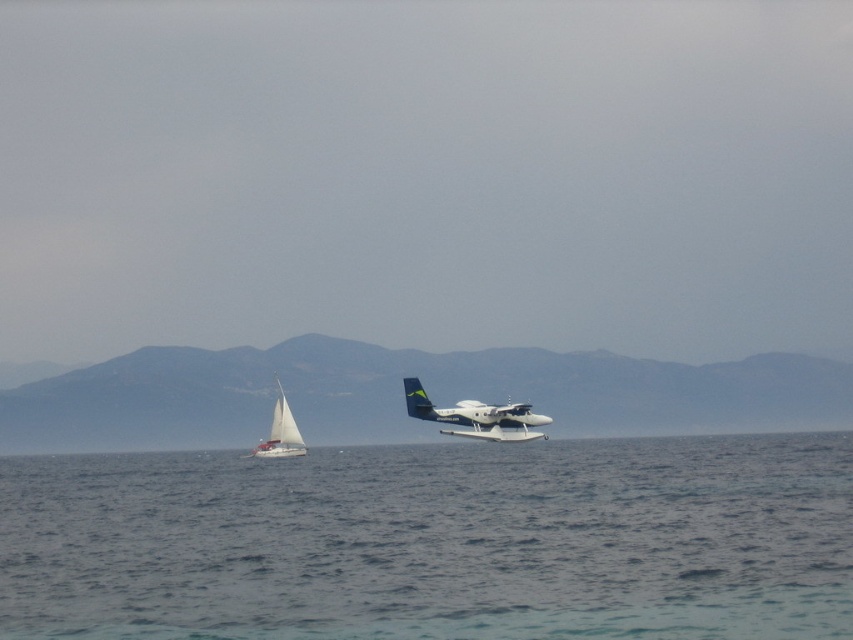
Who is shorter, white glossy seaplane at center or white matte sailboat at left?

Standing shorter between the two is white glossy seaplane at center.

Is white glossy seaplane at center further to the viewer compared to white matte sailboat at left?

No, it is not.

Is point (460, 404) positioned in front of point (270, 454)?

That is True.

Where is `white glossy seaplane at center`? white glossy seaplane at center is located at coordinates (476, 417).

Is clear blue water at center above white matte sailboat at left?

Yes.

Does clear blue water at center appear under white matte sailboat at left?

Actually, clear blue water at center is above white matte sailboat at left.

What do you see at coordinates (434, 541) in the screenshot? This screenshot has height=640, width=853. I see `clear blue water at center` at bounding box center [434, 541].

Locate an element on the screen. This screenshot has height=640, width=853. clear blue water at center is located at coordinates (434, 541).

Can you confirm if clear blue water at center is positioned below white glossy seaplane at center?

Indeed, clear blue water at center is positioned under white glossy seaplane at center.

Does clear blue water at center have a greater width compared to white glossy seaplane at center?

Correct, the width of clear blue water at center exceeds that of white glossy seaplane at center.

Where is `clear blue water at center`? This screenshot has width=853, height=640. clear blue water at center is located at coordinates (434, 541).